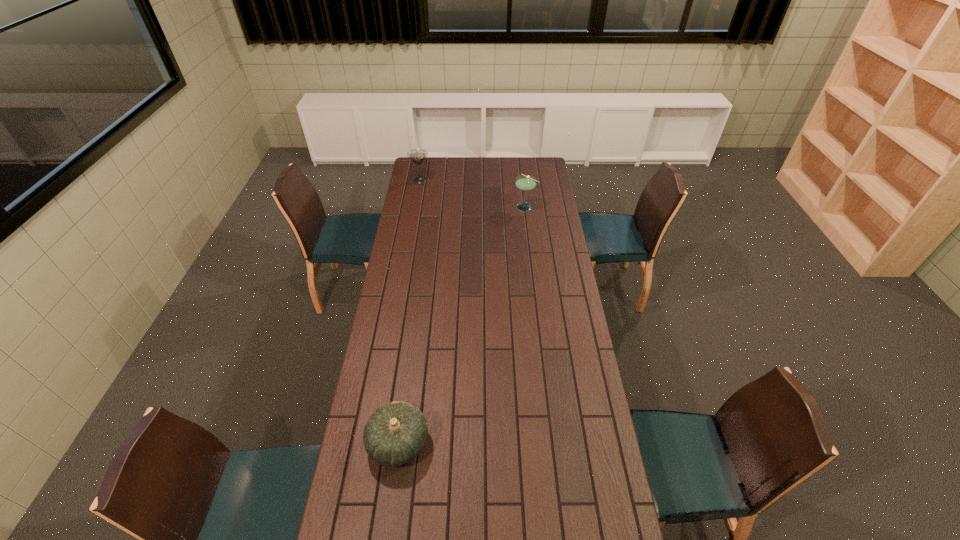
I want to click on gourd positioned at the left edge, so click(395, 434).

In order to click on object situated at the right edge in this screenshot , I will do `click(524, 183)`.

Locate an element on the screen. The image size is (960, 540). object present at the far left corner is located at coordinates point(418,155).

Locate an element on the screen. This screenshot has height=540, width=960. free space at the far edge of the desktop is located at coordinates (484, 166).

At what (x,y) coordinates should I click in order to perform the action: click on vacant space at the left edge of the desktop. Please return your answer as a coordinate pair (x, y). The image size is (960, 540). Looking at the image, I should click on (403, 259).

The image size is (960, 540). In the image, there is a desktop. What are the coordinates of `free space at the right edge` in the screenshot? It's located at (566, 323).

The height and width of the screenshot is (540, 960). What are the coordinates of `vacant region between the rightmost object and the farther martini` in the screenshot? It's located at (472, 193).

What are the coordinates of `vacant space that's between the nearest object and the rightmost object` in the screenshot? It's located at (462, 325).

Image resolution: width=960 pixels, height=540 pixels. I want to click on vacant area between the nearest object and the farthest object, so click(x=409, y=311).

Image resolution: width=960 pixels, height=540 pixels. Identify the location of vacant area that lies between the farther martini and the second nearest object. (472, 193).